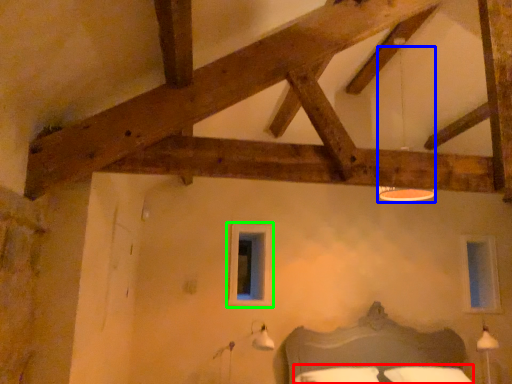
Question: Which object is the closest to the bedding (highlighted by a red box)? Choose among these: lamp (highlighted by a blue box) or window (highlighted by a green box).

Choices:
 (A) lamp
 (B) window

Answer: (B)